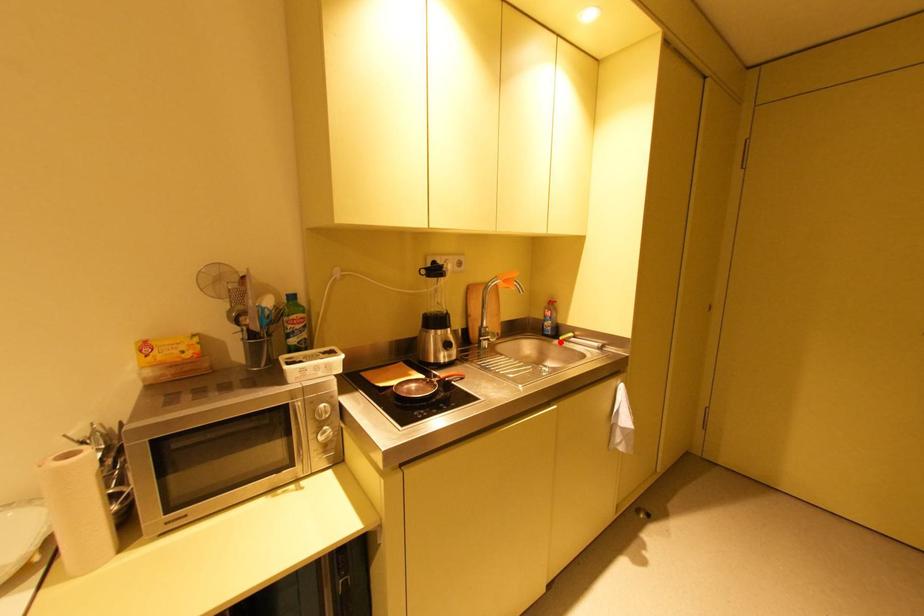
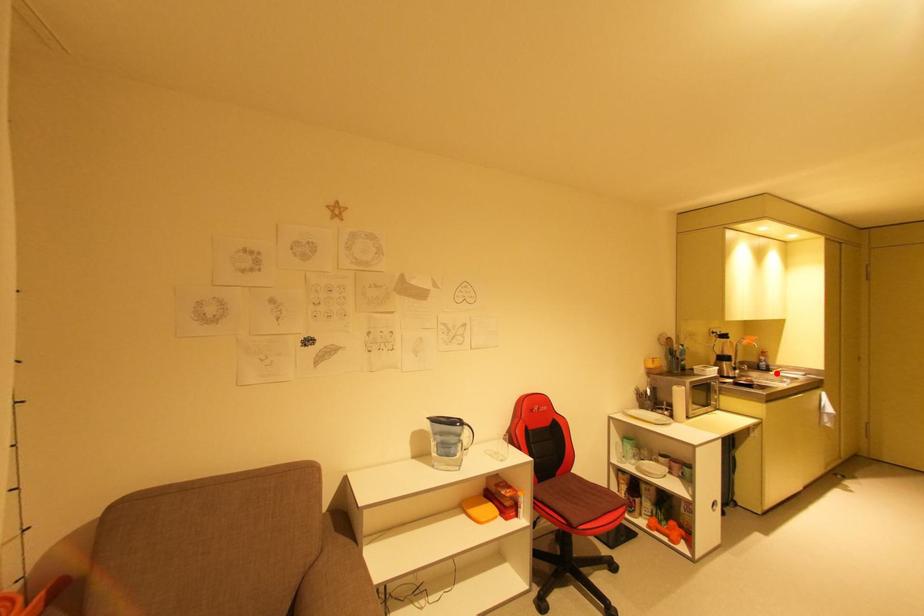
I am providing you with two images of the same scene from different viewpoints. A red point is marked on the first image and another point is marked on the second image. Is the marked point in image1 the same physical position as the marked point in image2?

Yes